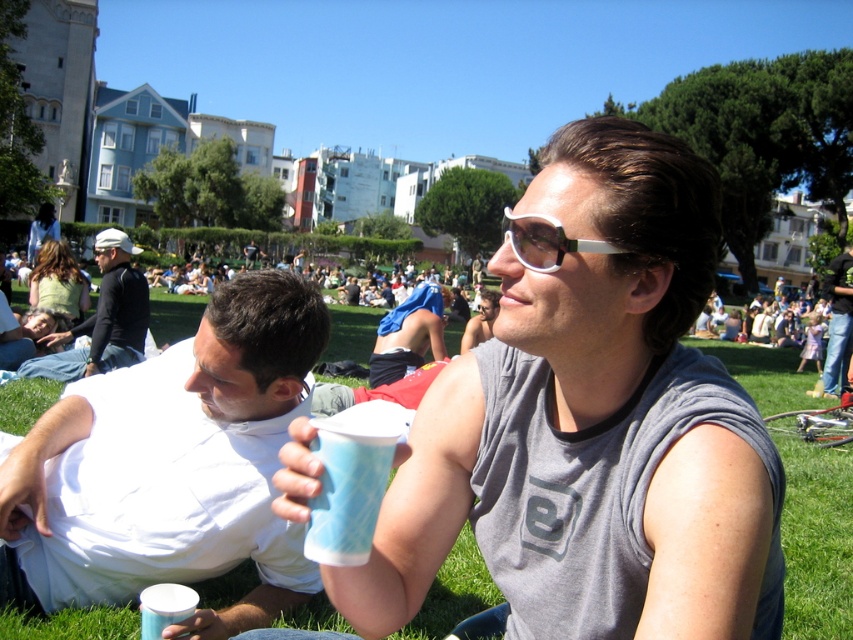
Question: Which object is farther from the camera taking this photo?

Choices:
 (A) white matte cup at lower left
 (B) green grass at center

Answer: (B)

Question: Can you confirm if matte plastic cup at center is positioned to the left of dark gray sweater at center?

Choices:
 (A) yes
 (B) no

Answer: (B)

Question: Estimate the real-world distances between objects in this image. Which object is farther from the white plastic goggles at center?

Choices:
 (A) dark gray sweater at center
 (B) denim jeans at center

Answer: (B)

Question: Can you confirm if dark gray sweater at center is positioned to the left of denim jeans at center?

Choices:
 (A) no
 (B) yes

Answer: (B)

Question: In this image, where is matte plastic cup at center located relative to blue fabric shirt at center?

Choices:
 (A) left
 (B) right

Answer: (B)

Question: Which of the following is the closest to the observer?

Choices:
 (A) white matte cup at lower left
 (B) matte plastic cup at center
 (C) white plastic goggles at center

Answer: (B)